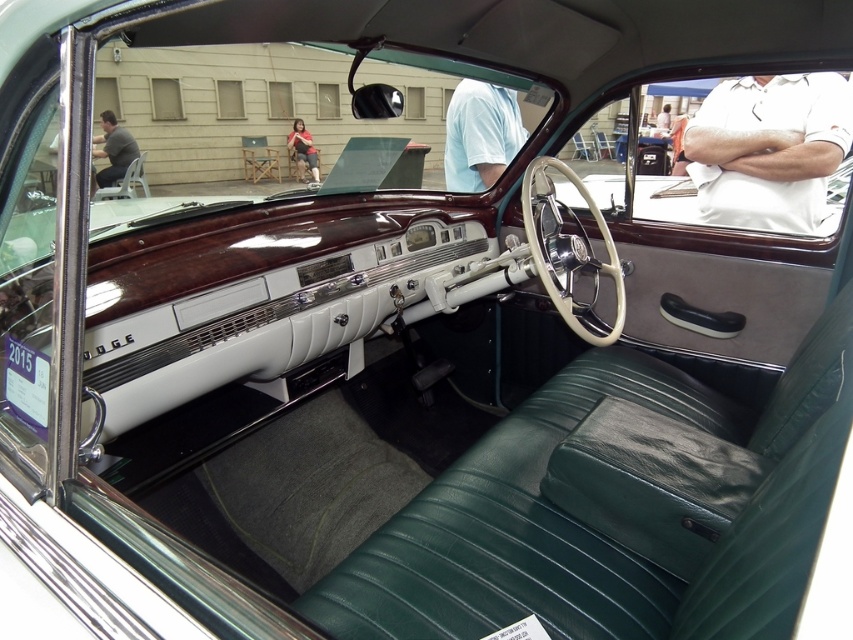
Question: Where is white cotton shirt at upper right located in relation to light blue fabric shirt at upper center in the image?

Choices:
 (A) above
 (B) below

Answer: (B)

Question: Which of the following is the closest to the observer?

Choices:
 (A) light blue fabric shirt at upper center
 (B) gray fabric shirt at upper left

Answer: (A)

Question: Based on their relative distances, which object is nearer to the white cotton shirt at upper right?

Choices:
 (A) light blue fabric shirt at upper center
 (B) gray fabric shirt at upper left

Answer: (A)

Question: Can you confirm if white cotton shirt at upper right is positioned below gray fabric shirt at upper left?

Choices:
 (A) no
 (B) yes

Answer: (B)

Question: Which of the following is the closest to the observer?

Choices:
 (A) (505, 115)
 (B) (744, 92)
 (C) (126, 138)

Answer: (B)

Question: Is white cotton shirt at upper right in front of gray fabric shirt at upper left?

Choices:
 (A) yes
 (B) no

Answer: (A)